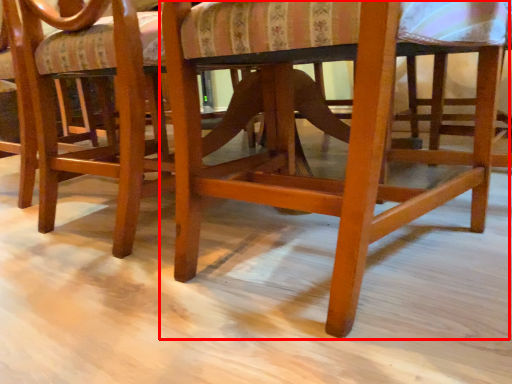
Question: From the image's perspective, where is chair (annotated by the red box) located relative to chair?

Choices:
 (A) below
 (B) above

Answer: (A)